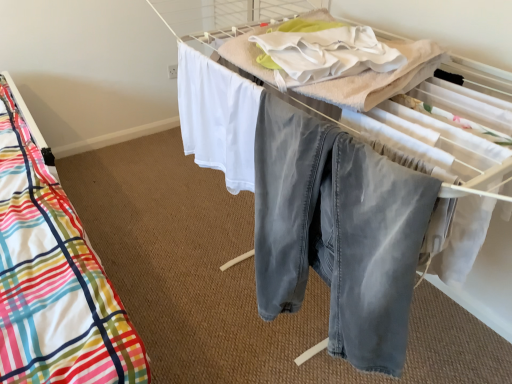
Question: In terms of width, does denim pants at center look wider or thinner when compared to white cotton blanket at upper center?

Choices:
 (A) thin
 (B) wide

Answer: (A)

Question: Would you say denim pants at center is to the left or to the right of white cotton blanket at upper center in the picture?

Choices:
 (A) left
 (B) right

Answer: (A)

Question: Which object is positioned farthest from the white cotton blanket at upper center?

Choices:
 (A) denim pants at center
 (B) plaid fabric bed at left

Answer: (A)

Question: Which of these objects is positioned closest to the denim pants at center?

Choices:
 (A) white cotton blanket at upper center
 (B) plaid fabric bed at left

Answer: (B)